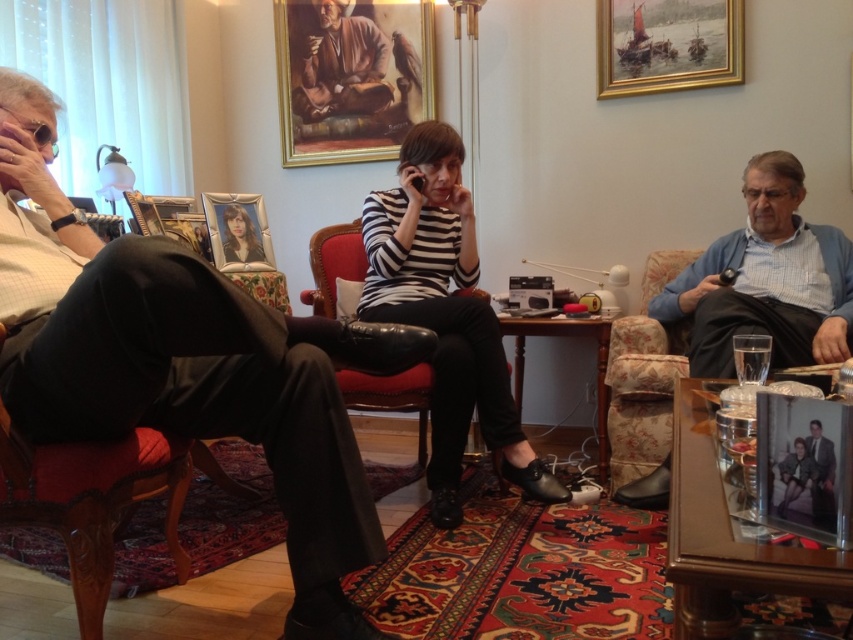
You are a photographer setting up a tripod in this living room. You need to position it so that both the striped fabric shirt at center and the oil painting portrait at upper center are visible in the frame. Which object should you place closer to the camera to ensure both are in focus?

The striped fabric shirt at center is much taller than the oil painting portrait at upper center, so placing the striped fabric shirt at center closer to the camera will help keep both in focus since it is larger and closer to the viewer.

You are standing in the living room and want to place a 3.5 feet wide sofa between the point marked at coordinates point (270, 332) and yourself. Is there enough space for the sofa?

The distance between point (270, 332) and the viewer is 4.26 feet. Since the sofa is 3.5 feet wide, there is enough space to place it as the available distance is greater than the sofa width.